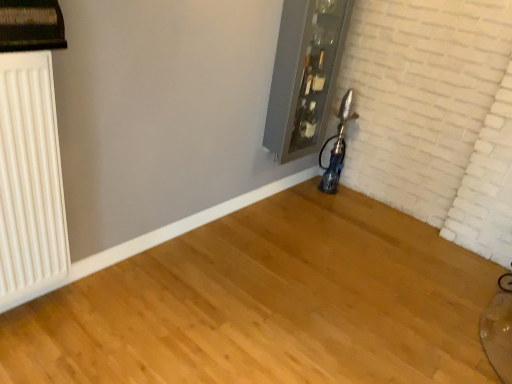
This screenshot has height=384, width=512. In order to click on metallic glass at upper center in this screenshot , I will do `click(315, 75)`.

This screenshot has height=384, width=512. What do you see at coordinates (315, 75) in the screenshot?
I see `metallic glass at upper center` at bounding box center [315, 75].

This screenshot has height=384, width=512. Find the location of `white matte radiator at left`. white matte radiator at left is located at coordinates (30, 181).

The height and width of the screenshot is (384, 512). What do you see at coordinates (30, 181) in the screenshot?
I see `white matte radiator at left` at bounding box center [30, 181].

The height and width of the screenshot is (384, 512). Identify the location of metallic glass at upper center. (315, 75).

Which object is positioned more to the left, metallic glass at upper center or white matte radiator at left?

From the viewer's perspective, white matte radiator at left appears more on the left side.

Is metallic glass at upper center in front of or behind white matte radiator at left in the image?

metallic glass at upper center is behind white matte radiator at left.

Considering the points (330, 12) and (34, 88), which point is behind, point (330, 12) or point (34, 88)?

The point (330, 12) is farther from the camera.

From the image's perspective, which is above, metallic glass at upper center or white matte radiator at left?

metallic glass at upper center, from the image's perspective.

From a real-world perspective, which is physically below, metallic glass at upper center or white matte radiator at left?

white matte radiator at left.

Which of these two, metallic glass at upper center or white matte radiator at left, is thinner?

Thinner between the two is white matte radiator at left.

Considering the sizes of objects metallic glass at upper center and white matte radiator at left in the image provided, who is shorter, metallic glass at upper center or white matte radiator at left?

white matte radiator at left is shorter.

Based on their sizes in the image, would you say metallic glass at upper center is bigger or smaller than white matte radiator at left?

In the image, metallic glass at upper center appears to be larger than white matte radiator at left.

Is metallic glass at upper center completely or partially outside of white matte radiator at left?

Yes.

Would you consider metallic glass at upper center to be distant from white matte radiator at left?

Yes, metallic glass at upper center is far from white matte radiator at left.

Is metallic glass at upper center oriented towards white matte radiator at left?

No.

Where is `radiator that is in front of the metallic glass at upper center`? The width and height of the screenshot is (512, 384). radiator that is in front of the metallic glass at upper center is located at coordinates 30,181.

Considering the positions of objects white matte radiator at left and metallic glass at upper center in the image provided, who is more to the right, white matte radiator at left or metallic glass at upper center?

metallic glass at upper center is more to the right.

Considering their positions, is white matte radiator at left located in front of or behind metallic glass at upper center?

Visually, white matte radiator at left is located in front of metallic glass at upper center.

Does point (55, 116) come farther from viewer compared to point (319, 131)?

No, (55, 116) is closer to viewer.

From the image's perspective, between white matte radiator at left and metallic glass at upper center, which one is located above?

metallic glass at upper center, from the image's perspective.

From a real-world perspective, who is located higher, white matte radiator at left or metallic glass at upper center?

metallic glass at upper center, from a real-world perspective.

In terms of width, does white matte radiator at left look wider or thinner when compared to metallic glass at upper center?

Considering their sizes, white matte radiator at left looks slimmer than metallic glass at upper center.

Considering the relative sizes of white matte radiator at left and metallic glass at upper center in the image provided, is white matte radiator at left taller than metallic glass at upper center?

No, white matte radiator at left is not taller than metallic glass at upper center.

Is white matte radiator at left bigger or smaller than metallic glass at upper center?

Clearly, white matte radiator at left is smaller in size than metallic glass at upper center.

Based on the photo, can we say white matte radiator at left lies outside metallic glass at upper center?

white matte radiator at left is positioned outside metallic glass at upper center.

Is white matte radiator at left not near metallic glass at upper center?

Yes, white matte radiator at left and metallic glass at upper center are quite far apart.

Could you tell me if white matte radiator at left is turned towards metallic glass at upper center?

No.

There is a white matte radiator at left. Identify the location of window frame above it (from a real-world perspective). coord(315,75).

Identify the location of window frame located above the white matte radiator at left (from the image's perspective). (315, 75).

Where is `radiator in front of the metallic glass at upper center`? The width and height of the screenshot is (512, 384). radiator in front of the metallic glass at upper center is located at coordinates (30, 181).